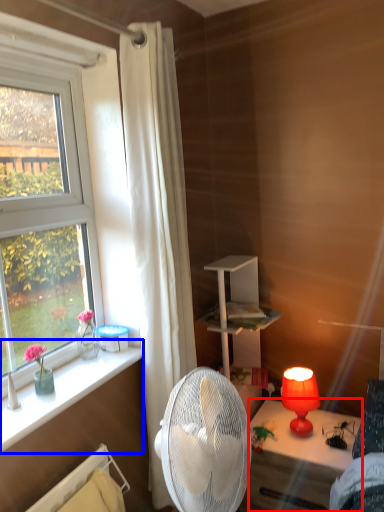
Question: Which point is further to the camera, desk (highlighted by a red box) or window sill (highlighted by a blue box)?

Choices:
 (A) desk
 (B) window sill

Answer: (A)